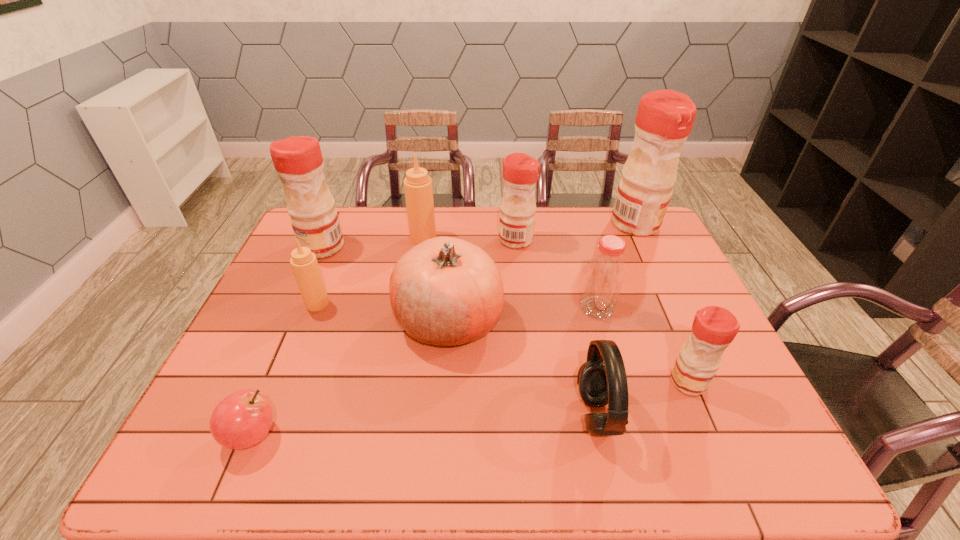
At what (x,y) coordinates should I click in order to perform the action: click on red condiment that is the closest to the bottle. Please return your answer as a coordinate pair (x, y). Looking at the image, I should click on point(714,328).

Image resolution: width=960 pixels, height=540 pixels. Find the location of `free spot that satisfies the following two spatial constraints: 1. on the front side of the nearest condiment; 2. on the left side of the bottle`. free spot that satisfies the following two spatial constraints: 1. on the front side of the nearest condiment; 2. on the left side of the bottle is located at coordinates (618, 382).

Where is `vacant area that satisfies the following two spatial constraints: 1. on the back side of the biggest red condiment; 2. on the right side of the third biggest red condiment`? The width and height of the screenshot is (960, 540). vacant area that satisfies the following two spatial constraints: 1. on the back side of the biggest red condiment; 2. on the right side of the third biggest red condiment is located at coordinates (515, 224).